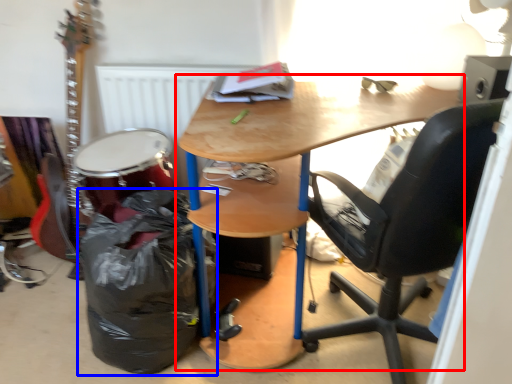
Question: Which of the following is the farthest to the observer, desk (highlighted by a red box) or garbage (highlighted by a blue box)?

Choices:
 (A) desk
 (B) garbage

Answer: (B)